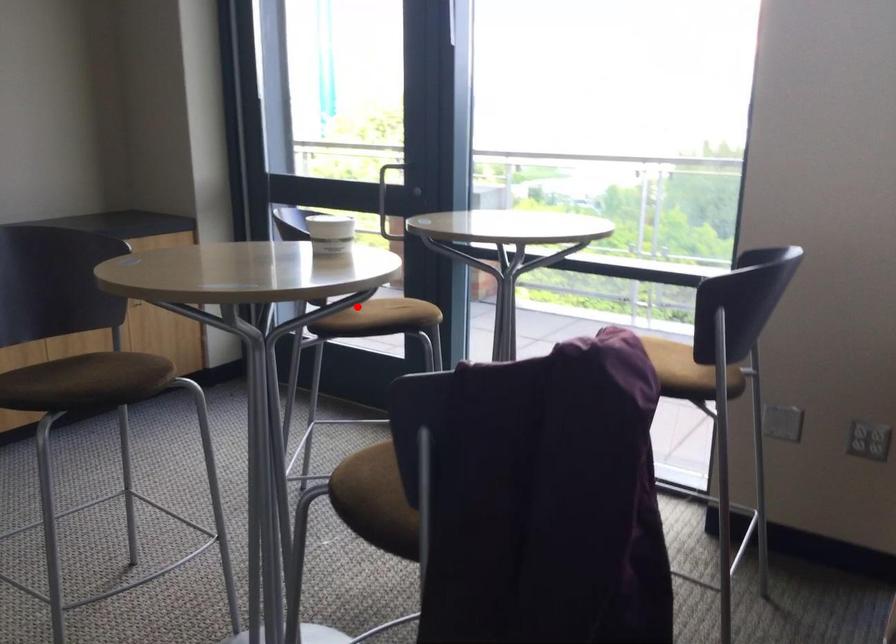
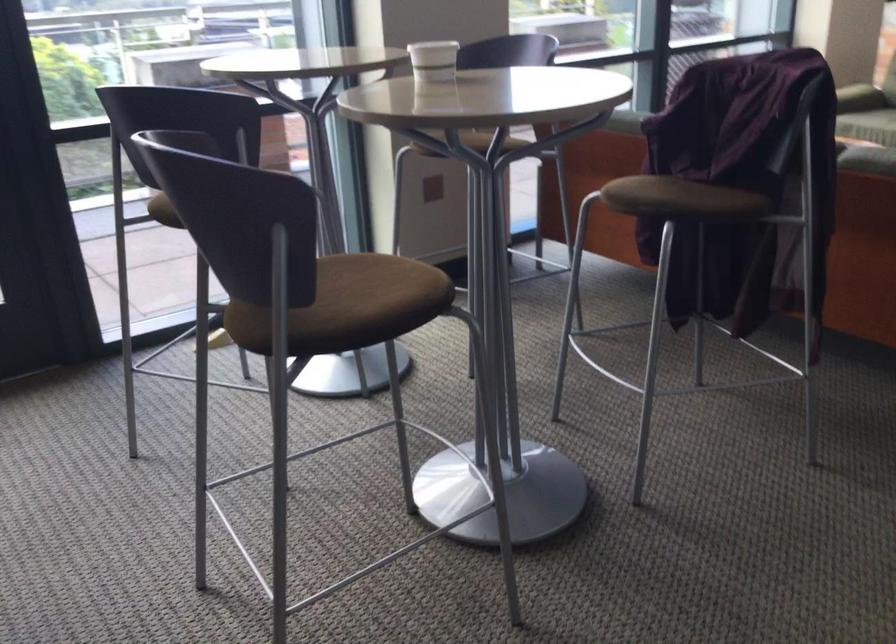
The point at the highlighted location is marked in the first image. Where is the corresponding point in the second image?

(162, 211)